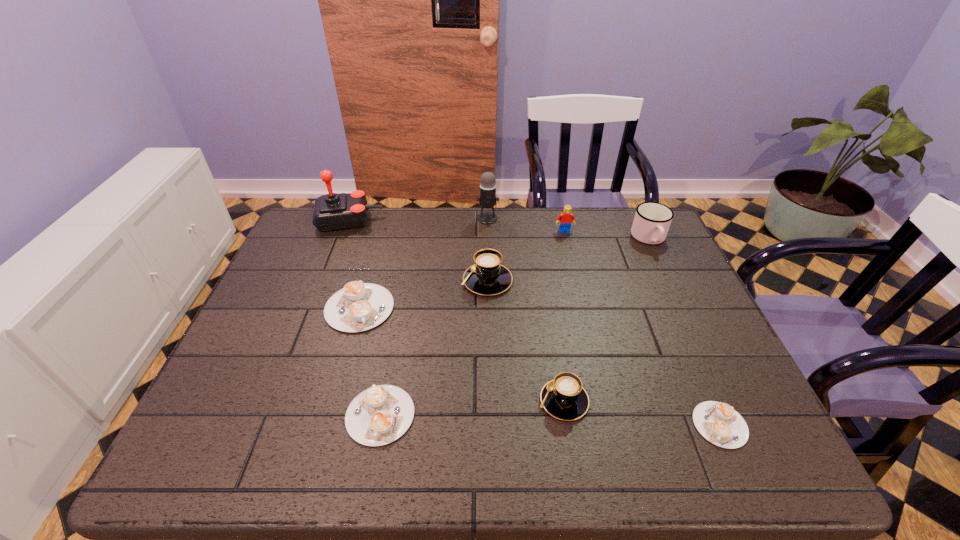
Find the location of a particular element. This screenshot has width=960, height=540. joystick is located at coordinates (333, 211).

Where is `gray microphone`? The image size is (960, 540). gray microphone is located at coordinates (487, 199).

This screenshot has width=960, height=540. Find the location of `the seventh object from left to right`. the seventh object from left to right is located at coordinates click(566, 218).

The width and height of the screenshot is (960, 540). Identify the location of Lego. (566, 218).

This screenshot has height=540, width=960. Find the location of `mug`. mug is located at coordinates (652, 220).

Image resolution: width=960 pixels, height=540 pixels. Identify the location of the bigger black cappuccino. (487, 276).

The width and height of the screenshot is (960, 540). In order to click on the left black cappuccino in this screenshot , I will do `click(487, 276)`.

The height and width of the screenshot is (540, 960). I want to click on the fourth cappuccino from left to right, so click(564, 398).

The width and height of the screenshot is (960, 540). In order to click on the sixth tallest object in this screenshot , I will do `click(564, 398)`.

Identify the location of the third tallest cappuccino. 359,306.